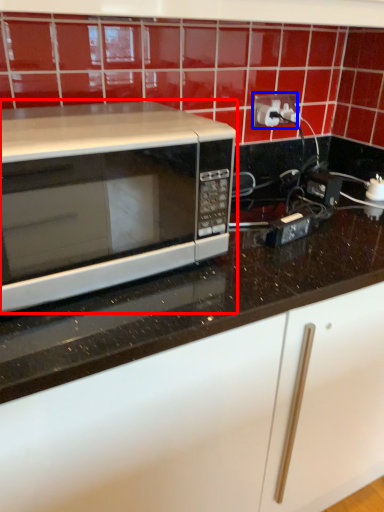
Question: Which point is further to the camera, microwave oven (highlighted by a red box) or electric outlet (highlighted by a blue box)?

Choices:
 (A) microwave oven
 (B) electric outlet

Answer: (B)